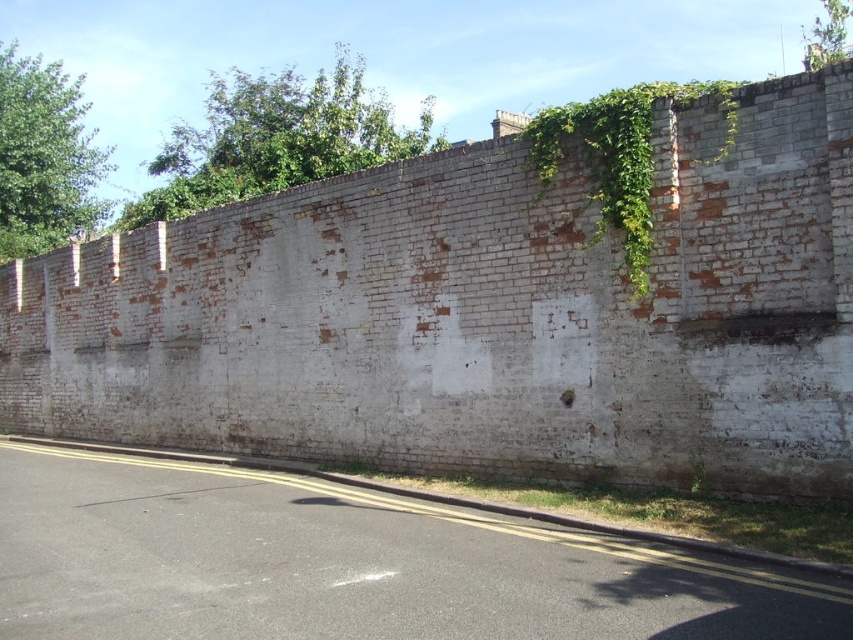
Measure the distance between green leafy ivy at upper center and green leafy ivy at upper left.

A distance of 7.22 meters exists between green leafy ivy at upper center and green leafy ivy at upper left.

Between point (315, 112) and point (32, 237), which one is positioned in front?

Positioned in front is point (315, 112).

Is point (216, 195) farther from viewer compared to point (57, 125)?

That is False.

The image size is (853, 640). Identify the location of green leafy ivy at upper center. (276, 138).

How distant is green leafy ivy at upper center from green leafy vine at upper right?

green leafy ivy at upper center and green leafy vine at upper right are 47.12 feet apart.

This screenshot has height=640, width=853. Find the location of `green leafy ivy at upper center`. green leafy ivy at upper center is located at coordinates (276, 138).

The width and height of the screenshot is (853, 640). In order to click on green leafy ivy at upper center in this screenshot , I will do (276, 138).

Is green leafy ivy at upper left positioned behind green leafy vine at upper right?

Yes, it is behind green leafy vine at upper right.

Is green leafy ivy at upper left positioned before green leafy vine at upper right?

No, green leafy ivy at upper left is further to the viewer.

Which is in front, point (48, 182) or point (531, 138)?

Point (531, 138) is in front.

Identify the location of green leafy ivy at upper left. This screenshot has width=853, height=640. (44, 156).